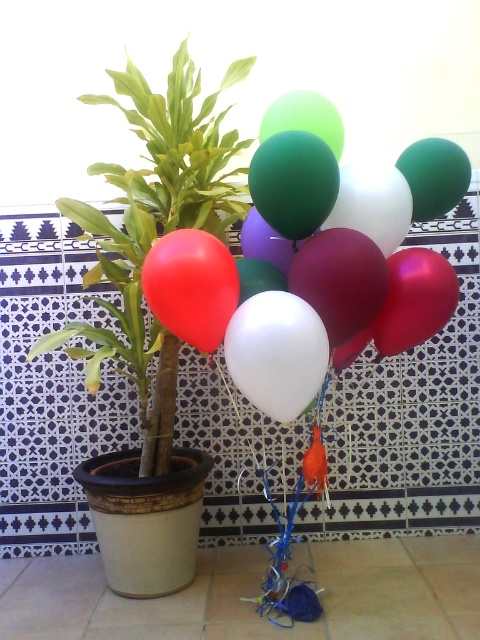
Question: Does matte white balloon at center appear on the right side of green matte plant at left?

Choices:
 (A) no
 (B) yes

Answer: (B)

Question: Observing the image, what is the correct spatial positioning of matte white balloon at center in reference to green matte plant at left?

Choices:
 (A) right
 (B) left

Answer: (A)

Question: Which object is farther from the camera taking this photo?

Choices:
 (A) matte white balloon at center
 (B) matte red balloon at left

Answer: (A)

Question: Is matte white balloon at center further to camera compared to matte red balloon at left?

Choices:
 (A) no
 (B) yes

Answer: (B)

Question: Which of the following is the closest to the observer?

Choices:
 (A) matte red balloon at left
 (B) matte white balloon at center
 (C) green matte plant at left

Answer: (A)

Question: Which point is farther to the camera?

Choices:
 (A) (309, 220)
 (B) (164, 326)

Answer: (B)